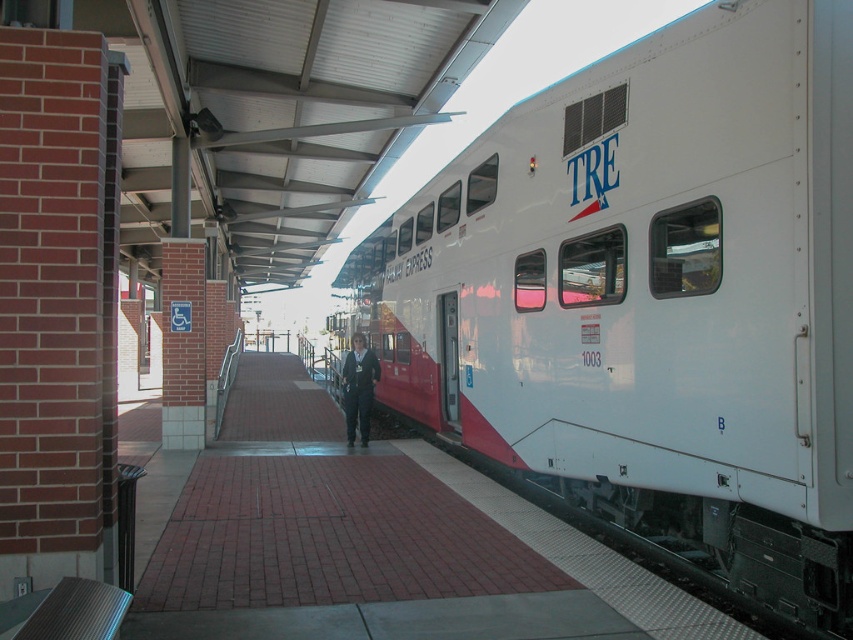
Question: Which point is farther to the camera?

Choices:
 (A) white glossy train car at center
 (B) dark blue fabric jacket at center

Answer: (B)

Question: Does white glossy train car at center lie behind dark blue fabric jacket at center?

Choices:
 (A) yes
 (B) no

Answer: (B)

Question: Among these points, which one is nearest to the camera?

Choices:
 (A) (602, 76)
 (B) (369, 376)

Answer: (A)

Question: Is white glossy train car at center below dark blue fabric jacket at center?

Choices:
 (A) yes
 (B) no

Answer: (B)

Question: Does white glossy train car at center have a greater width compared to dark blue fabric jacket at center?

Choices:
 (A) yes
 (B) no

Answer: (A)